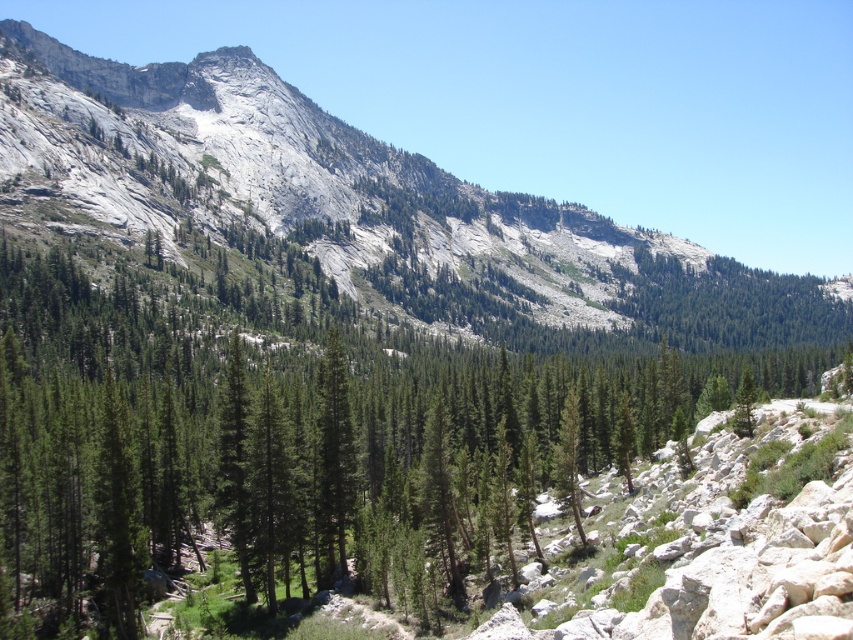
You are standing on the dirt path in the middle ground of the mountain landscape. You see the green matte tree at center and the gray rock mountain at center. Which object is positioned to the left when viewed from your perspective?

The green matte tree at center is positioned to the left of the gray rock mountain at center.